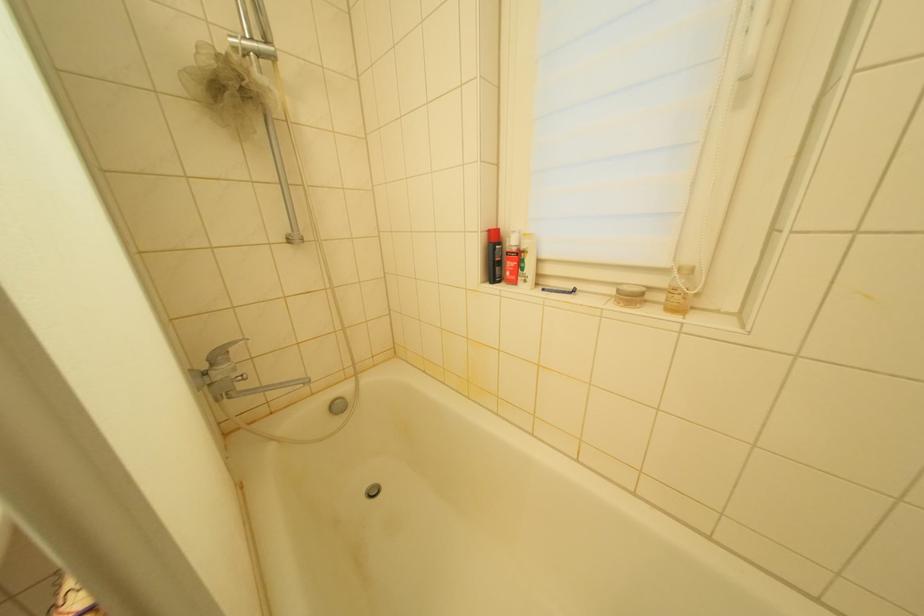
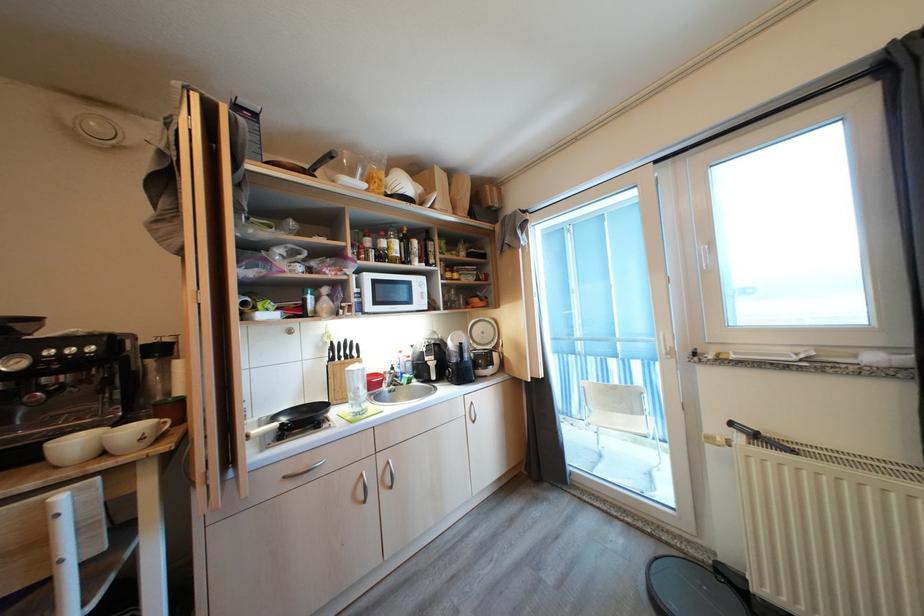
From the picture: Which direction would the cameraman need to move to produce the second image?

The cameraman moved toward right, backward.